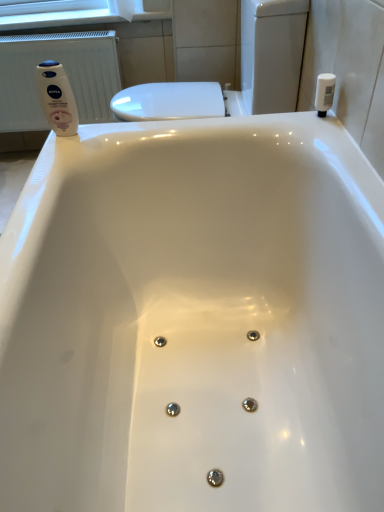
Locate an element on the screen. The width and height of the screenshot is (384, 512). vacant space situated on the left part of white matte toilet paper at upper left is located at coordinates (83, 16).